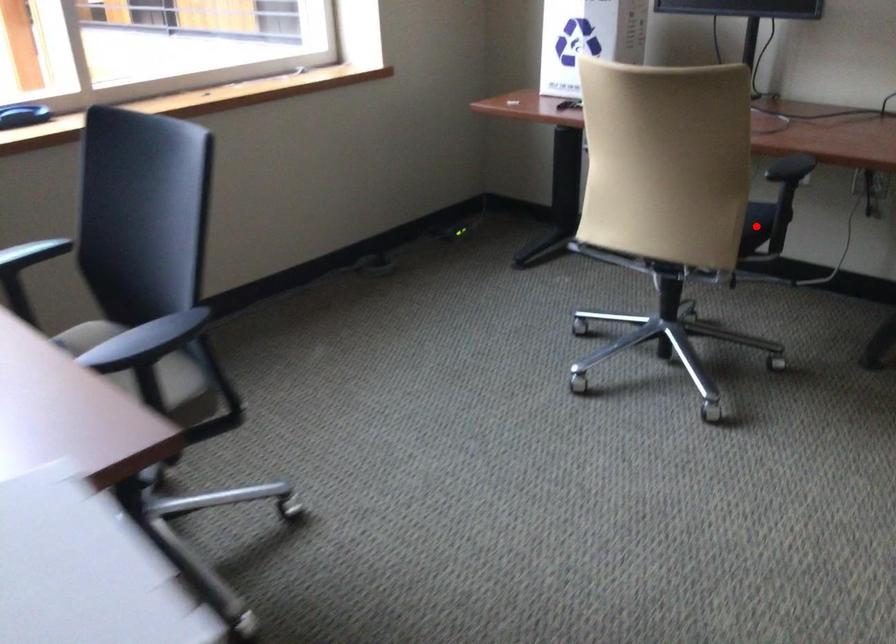
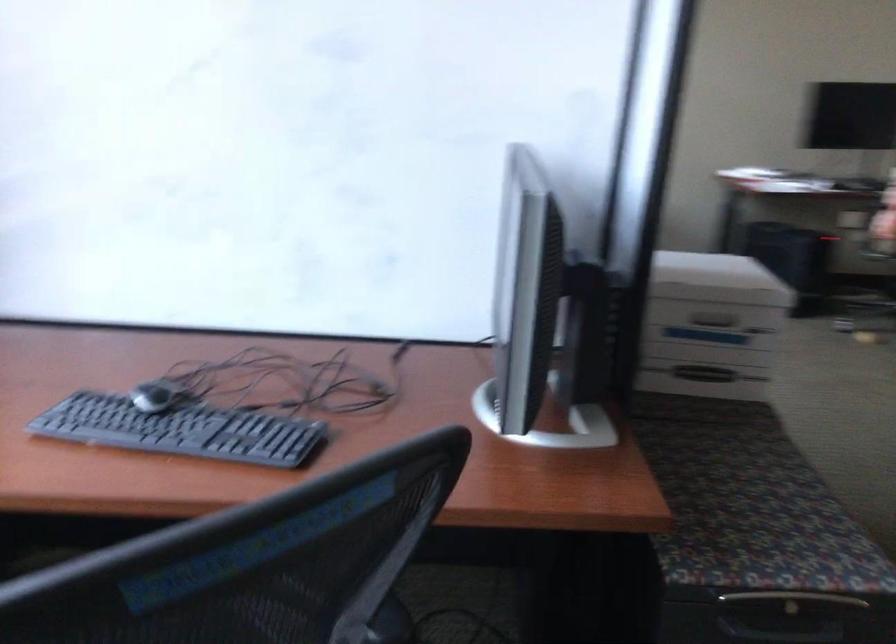
Question: I am providing you with two images of the same scene from different viewpoints. A red point is marked on the first image. At the location where the point appears in image 1, is it still visible in image 2?

Choices:
 (A) Yes
 (B) No

Answer: (B)